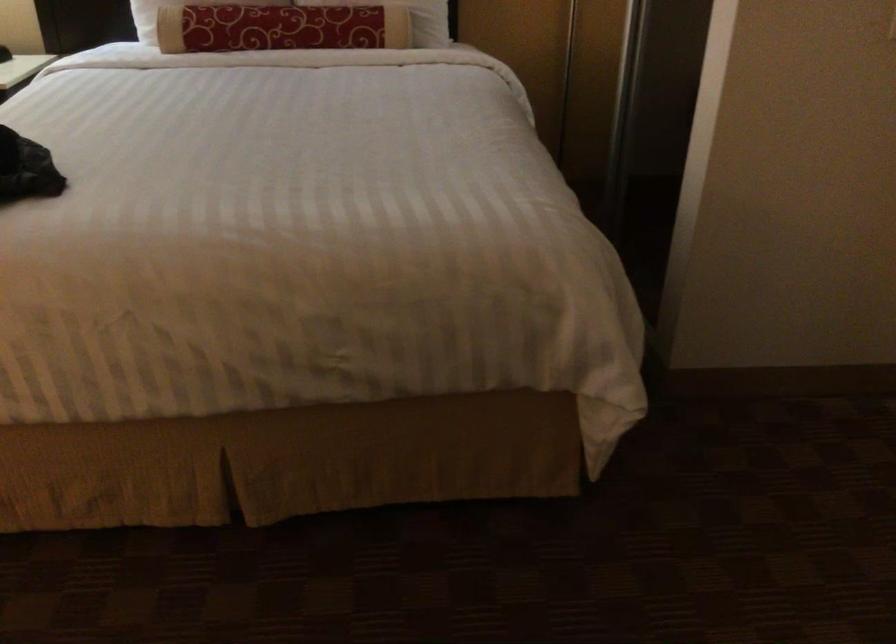
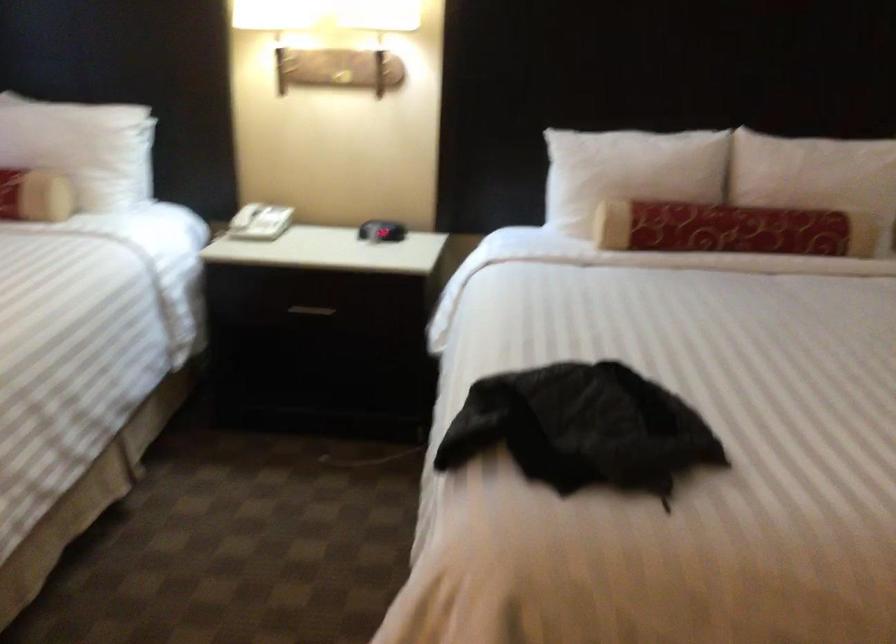
Question: In a continuous first-person perspective shot, in which direction is the camera moving?

Choices:
 (A) Left
 (B) Right
 (C) Forward
 (D) Backward

Answer: (A)